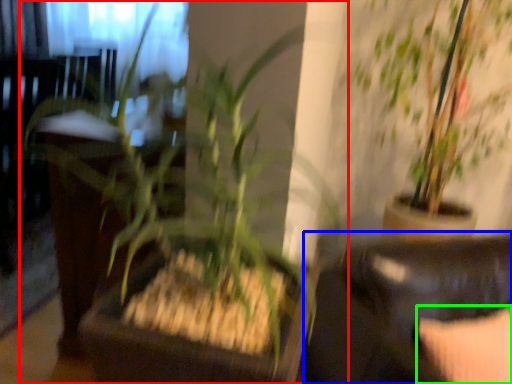
Question: Based on their relative distances, which object is nearer to houseplant (highlighted by a red box)? Choose from rocking chair (highlighted by a blue box) and pillow (highlighted by a green box).

Choices:
 (A) rocking chair
 (B) pillow

Answer: (A)